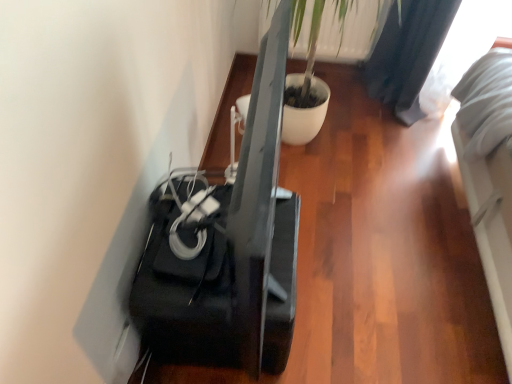
Question: Is black glossy speaker at lower left outside green leafy plant at upper center?

Choices:
 (A) yes
 (B) no

Answer: (A)

Question: Can you confirm if black glossy speaker at lower left is thinner than green leafy plant at upper center?

Choices:
 (A) yes
 (B) no

Answer: (B)

Question: From a real-world perspective, is black glossy speaker at lower left below green leafy plant at upper center?

Choices:
 (A) no
 (B) yes

Answer: (B)

Question: Is black glossy speaker at lower left oriented away from green leafy plant at upper center?

Choices:
 (A) no
 (B) yes

Answer: (A)

Question: From a real-world perspective, is black glossy speaker at lower left on top of green leafy plant at upper center?

Choices:
 (A) no
 (B) yes

Answer: (A)

Question: Is black glossy speaker at lower left touching green leafy plant at upper center?

Choices:
 (A) yes
 (B) no

Answer: (B)

Question: Does green leafy plant at upper center contain black glossy speaker at lower left?

Choices:
 (A) yes
 (B) no

Answer: (B)

Question: Considering the relative sizes of green leafy plant at upper center and black glossy speaker at lower left in the image provided, is green leafy plant at upper center shorter than black glossy speaker at lower left?

Choices:
 (A) no
 (B) yes

Answer: (B)

Question: Does green leafy plant at upper center come in front of black glossy speaker at lower left?

Choices:
 (A) no
 (B) yes

Answer: (A)

Question: Considering the relative sizes of green leafy plant at upper center and black glossy speaker at lower left in the image provided, is green leafy plant at upper center bigger than black glossy speaker at lower left?

Choices:
 (A) yes
 (B) no

Answer: (B)

Question: Considering the relative sizes of green leafy plant at upper center and black glossy speaker at lower left in the image provided, is green leafy plant at upper center wider than black glossy speaker at lower left?

Choices:
 (A) no
 (B) yes

Answer: (A)

Question: Could you tell me if green leafy plant at upper center is facing black glossy speaker at lower left?

Choices:
 (A) no
 (B) yes

Answer: (B)

Question: Is black glossy speaker at lower left wider or thinner than green leafy plant at upper center?

Choices:
 (A) thin
 (B) wide

Answer: (B)